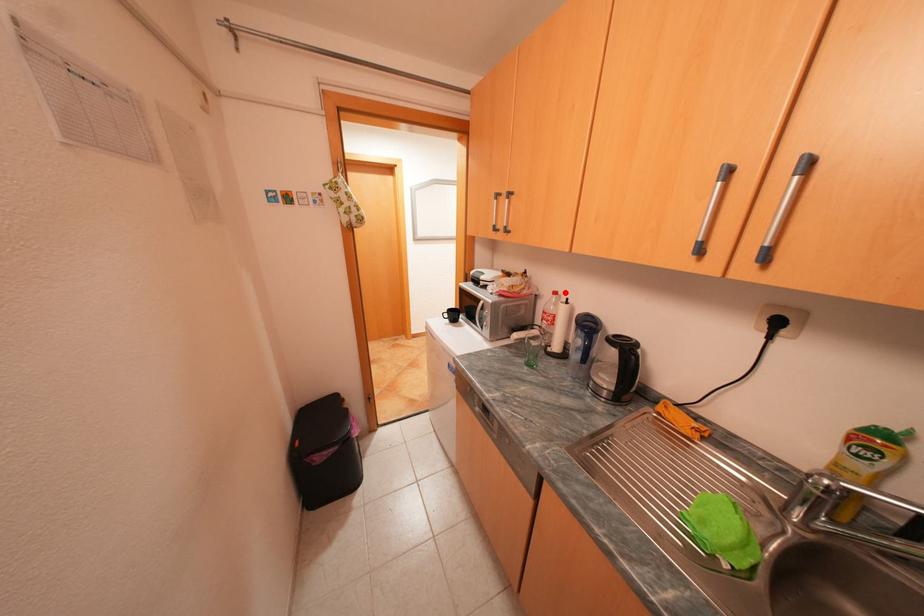
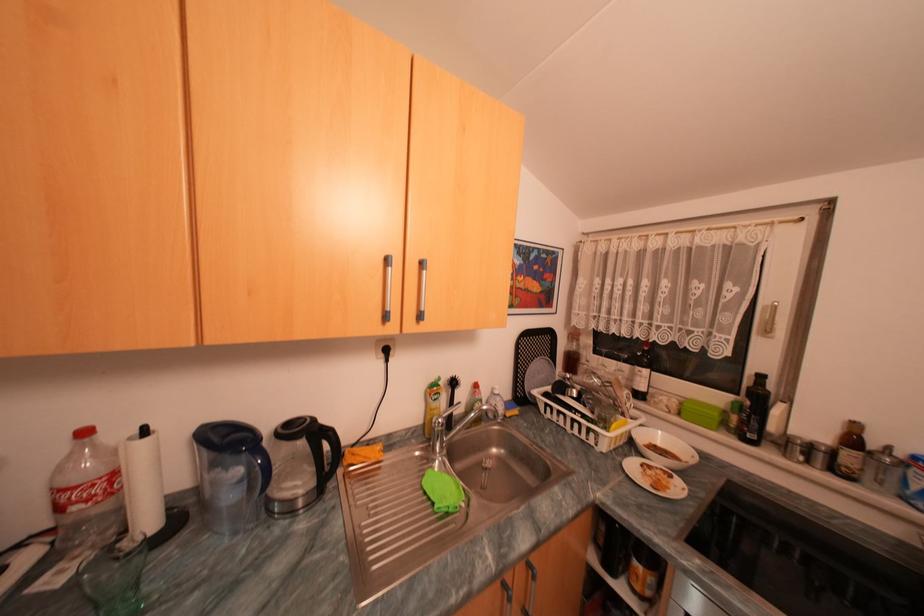
In the second image, find the point that corresponds to the highlighted location in the first image.

(94, 432)